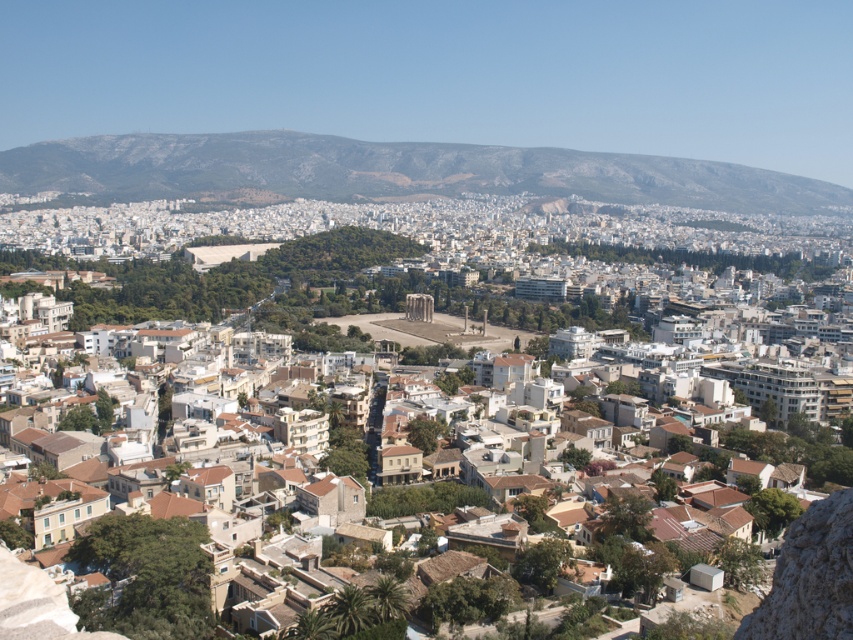
You are standing in the city and want to take a photo of the gray rocky mountain at upper center with the white stone buildings at center in the background. Can you position yourself so that the mountain is to the left of the buildings in the photo?

Yes, since the white stone buildings at center are already to the right of the gray rocky mountain at upper center, positioning yourself appropriately would allow the mountain to appear to the left of the buildings in the photo.

You are standing at the point with coordinates point (171, 184) and want to walk to the point with coordinates point (254, 298). Based on the scene description, will the path between these two points be obstructed by any of the buildings or structures mentioned?

Point (254, 298) is in front of point (171, 184), so the path between them would not be obstructed by buildings or structures since the destination point is closer to the viewer than the starting point.